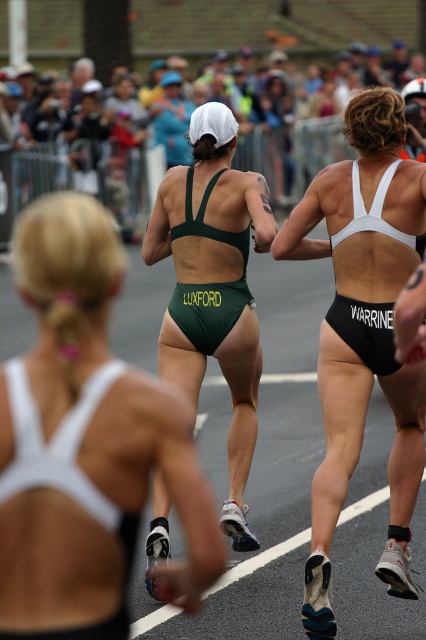
Which of these two, white matte bikini top at upper center or green matte swimsuit at center, stands shorter?

Standing shorter between the two is green matte swimsuit at center.

Does point (397, 138) come closer to viewer compared to point (242, 433)?

That is True.

This screenshot has width=426, height=640. Find the location of `white matte bikini top at upper center`. white matte bikini top at upper center is located at coordinates coord(362,332).

Between point (43, 378) and point (178, 273), which one is positioned behind?

Point (178, 273)

Is point (213, 525) closer to camera compared to point (224, 513)?

Yes, it is in front of point (224, 513).

Where is `white matte sports bra at upper center`? The width and height of the screenshot is (426, 640). white matte sports bra at upper center is located at coordinates (86, 444).

Does white matte sports bra at upper center appear on the right side of white matte bikini top at upper center?

In fact, white matte sports bra at upper center is to the left of white matte bikini top at upper center.

Can you confirm if white matte sports bra at upper center is bigger than white matte bikini top at upper center?

Actually, white matte sports bra at upper center might be smaller than white matte bikini top at upper center.

Where is `white matte sports bra at upper center`? Image resolution: width=426 pixels, height=640 pixels. white matte sports bra at upper center is located at coordinates (86, 444).